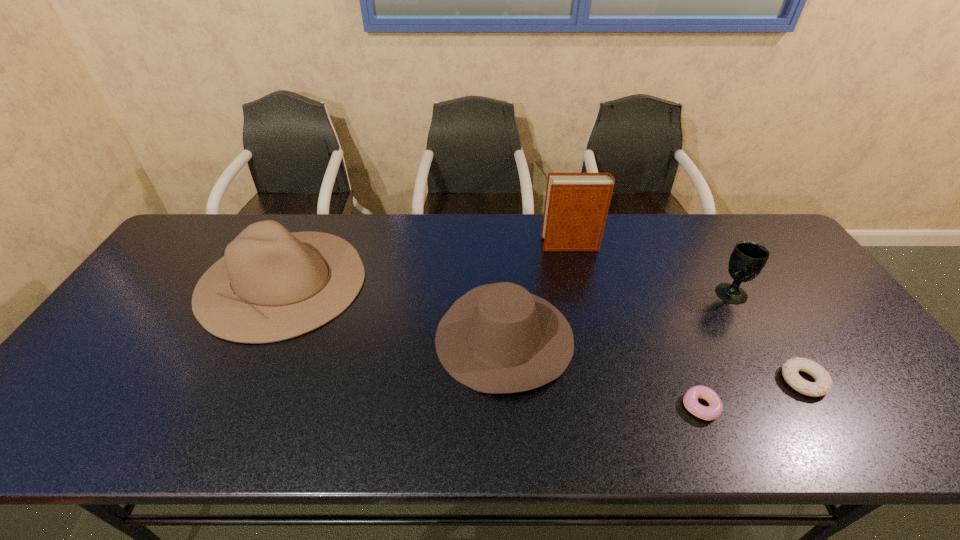
Identify the location of vacant space in between the leftmost object and the cowboy hat. (394, 309).

I want to click on free space between the chalice and the cowboy hat, so click(x=617, y=315).

Where is `free space between the tallest object and the right doughnut`? Image resolution: width=960 pixels, height=540 pixels. free space between the tallest object and the right doughnut is located at coordinates (687, 313).

Find the location of a particular element. This screenshot has width=960, height=540. vacant space in between the chalice and the hardback book is located at coordinates (651, 269).

The image size is (960, 540). In order to click on object that ranks as the fifth closest to the fourth tallest object in this screenshot , I will do `click(823, 384)`.

Select which object appears as the third closest to the third object from right to left. Please provide its 2D coordinates. Your answer should be formatted as a tuple, i.e. [(x, y)], where the tuple contains the x and y coordinates of a point satisfying the conditions above.

[(747, 259)]

What are the coordinates of `vacant space that satisfies the following two spatial constraints: 1. on the open cover of the hardback book; 2. on the left side of the right doughnut` in the screenshot? It's located at (603, 381).

Locate an element on the screen. Image resolution: width=960 pixels, height=540 pixels. vacant area that satisfies the following two spatial constraints: 1. on the open cover of the tallest object; 2. on the front side of the leftmost object is located at coordinates [x=579, y=281].

I want to click on free space that satisfies the following two spatial constraints: 1. on the front side of the cowboy hat; 2. on the left side of the right doughnut, so click(507, 381).

You are a GUI agent. You are given a task and a screenshot of the screen. Output one action in this format:
    pyautogui.click(x=<x>, y=<y>)
    Task: Click on the vacant space that satisfies the following two spatial constraints: 1. on the open cover of the chalice; 2. on the left side of the hardback book
    This screenshot has width=960, height=540.
    Given the screenshot: What is the action you would take?
    pyautogui.click(x=582, y=293)